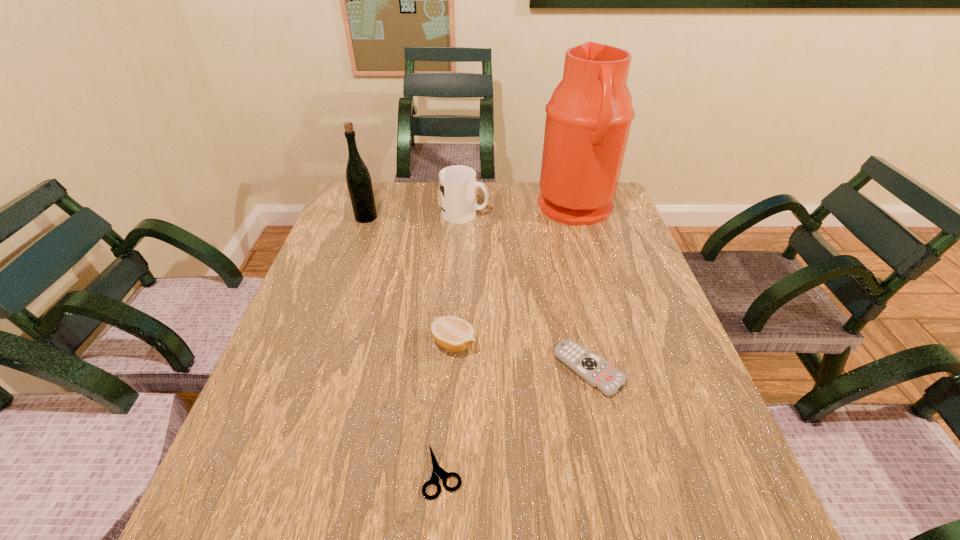
Locate an element on the screen. Image resolution: width=960 pixels, height=540 pixels. object at the left edge is located at coordinates (359, 183).

I want to click on water jug that is positioned at the right edge, so click(x=588, y=118).

The height and width of the screenshot is (540, 960). Find the location of `remote control located in the right edge section of the desktop`. remote control located in the right edge section of the desktop is located at coordinates (597, 372).

What are the coordinates of `object located in the far left corner section of the desktop` in the screenshot? It's located at (359, 183).

Identify the location of object positioned at the far right corner. The image size is (960, 540). (588, 118).

This screenshot has width=960, height=540. Find the location of `vacant space at the far edge of the desktop`. vacant space at the far edge of the desktop is located at coordinates (497, 197).

Locate an element on the screen. free space at the near edge of the desktop is located at coordinates [370, 513].

The height and width of the screenshot is (540, 960). What are the coordinates of `vacant space at the left edge` in the screenshot? It's located at (371, 231).

In the image, there is a desktop. Where is `vacant space at the right edge`? This screenshot has height=540, width=960. vacant space at the right edge is located at coordinates (710, 486).

In the image, there is a desktop. Where is `free space at the far left corner`? The width and height of the screenshot is (960, 540). free space at the far left corner is located at coordinates (375, 193).